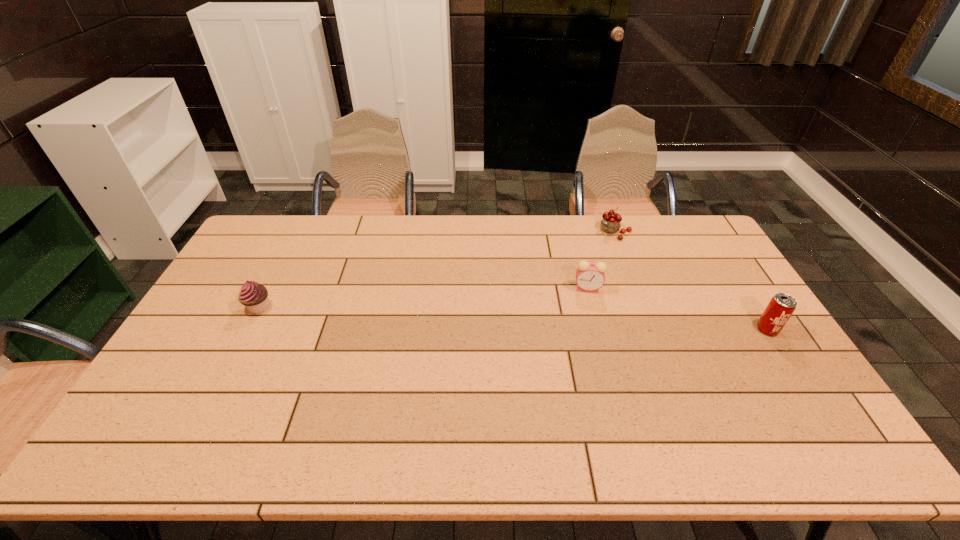
I want to click on free space located 0.230m on the handle side of the second object from right to left, so click(576, 272).

Where is `free location located on the handle side of the second object from right to left`? This screenshot has width=960, height=540. free location located on the handle side of the second object from right to left is located at coordinates (568, 280).

This screenshot has height=540, width=960. Find the location of `vacant space situated 0.100m on the handle side of the second object from right to left`. vacant space situated 0.100m on the handle side of the second object from right to left is located at coordinates (593, 253).

What are the coordinates of `free space located 0.300m on the face of the third nearest object` in the screenshot? It's located at (512, 341).

This screenshot has width=960, height=540. In order to click on vacant position located on the face of the third nearest object in this screenshot , I will do `click(560, 306)`.

Locate an element on the screen. The height and width of the screenshot is (540, 960). free space located 0.350m on the face of the third nearest object is located at coordinates (499, 350).

You are a GUI agent. You are given a task and a screenshot of the screen. Output one action in this format:
    pyautogui.click(x=<x>, y=<y>)
    Task: Click on the object at the far edge
    The image size is (960, 540).
    Given the screenshot: What is the action you would take?
    pyautogui.click(x=611, y=222)

Locate an element on the screen. Image resolution: width=960 pixels, height=540 pixels. object situated at the left edge is located at coordinates (254, 296).

Find the location of `object that is at the right edge`. object that is at the right edge is located at coordinates 780,308.

Identify the location of vacant space at the far edge. (379, 222).